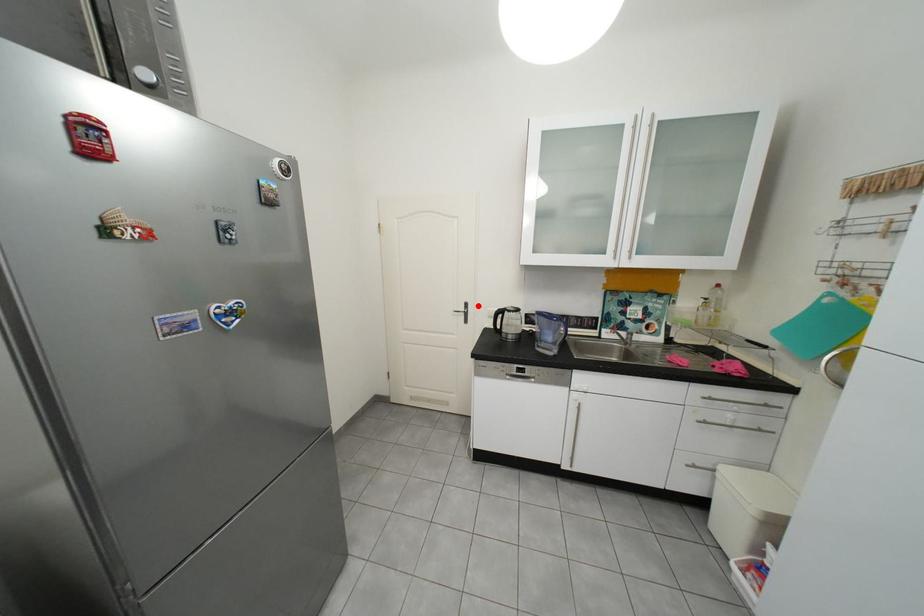
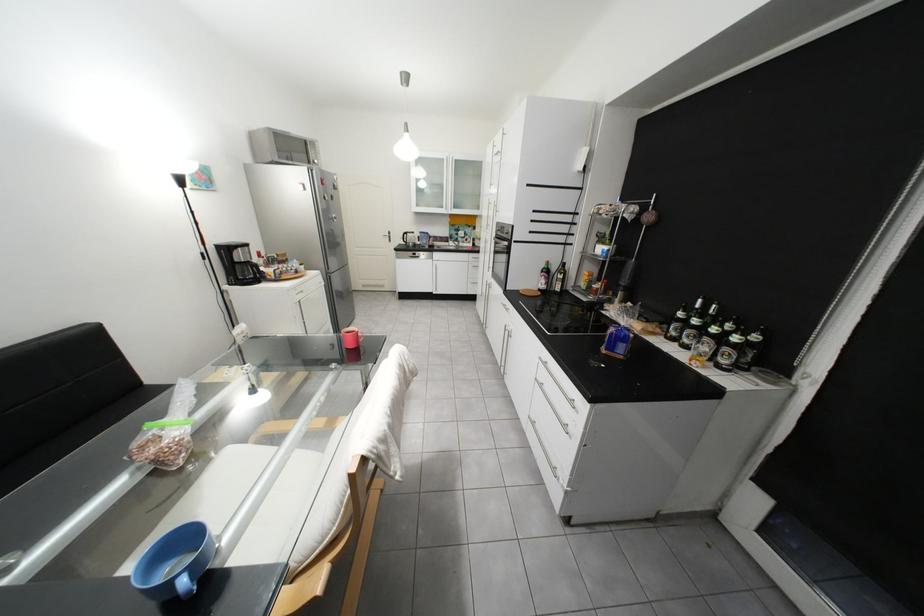
Question: I am providing you with two images of the same scene from different viewpoints. In image1, a red point is highlighted. Considering the same 3D point in image2, which of the following is correct?

Choices:
 (A) It is closer
 (B) It is farther

Answer: (A)